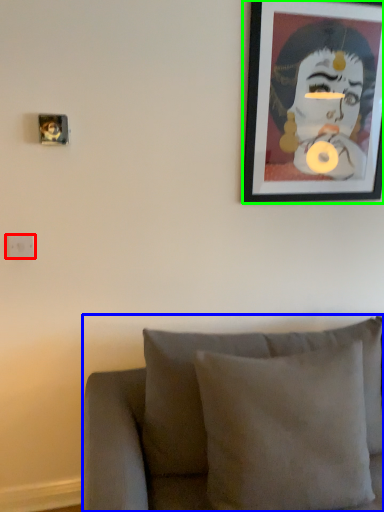
Question: Which is nearer to the electric outlet (highlighted by a red box)? furniture (highlighted by a blue box) or picture frame (highlighted by a green box).

Choices:
 (A) furniture
 (B) picture frame

Answer: (A)